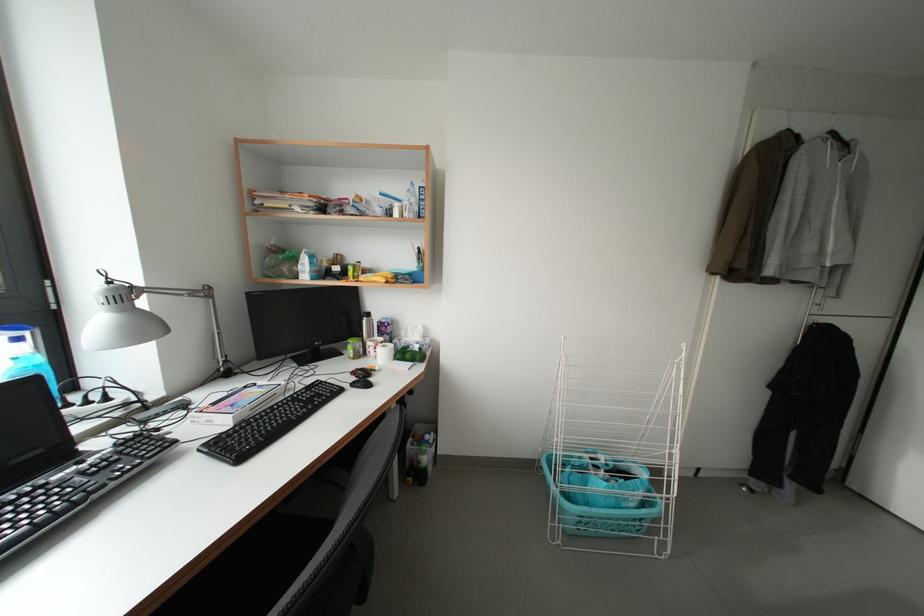
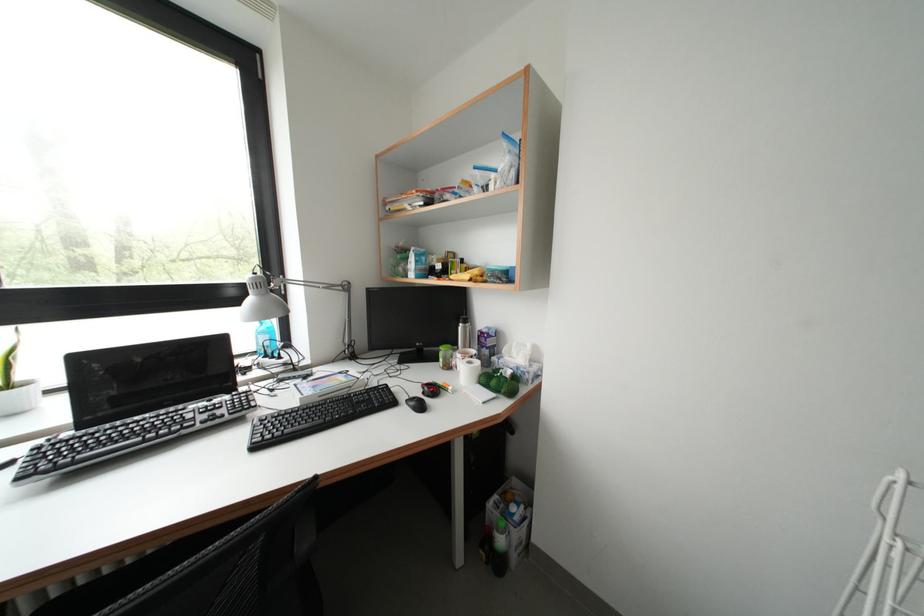
The point at (415, 361) is marked in the first image. Where is the corresponding point in the second image?

(500, 387)